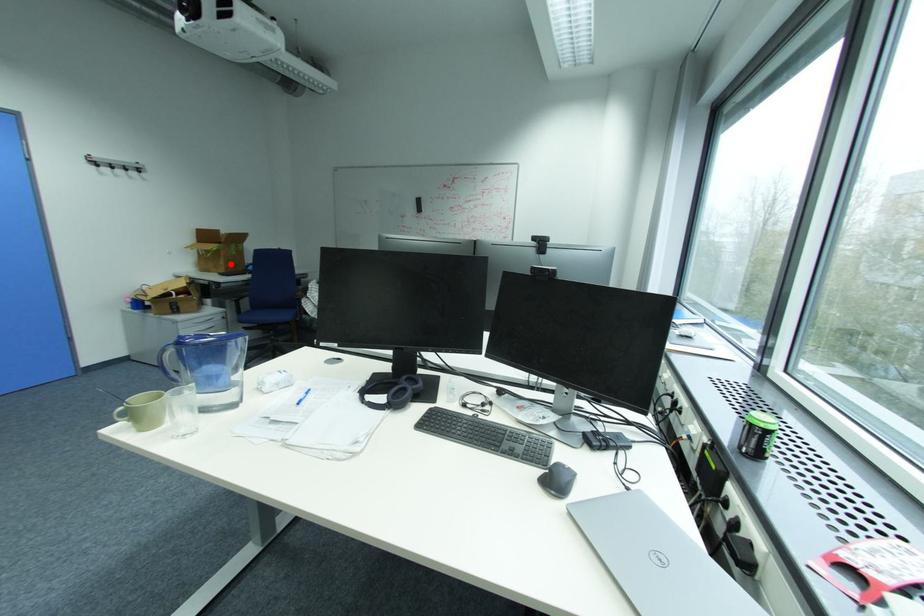
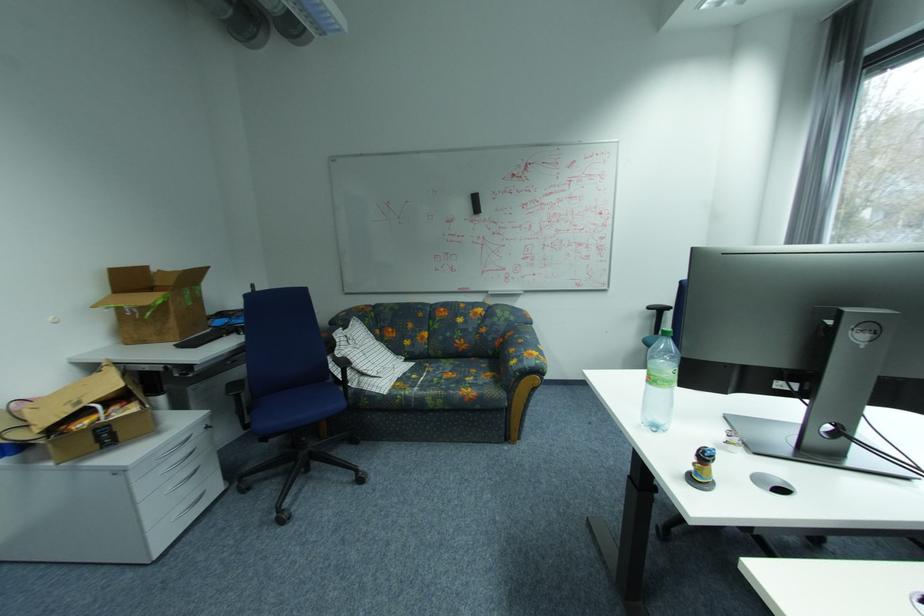
The point at the highlighted location is marked in the first image. Where is the corresponding point in the second image?

(180, 323)